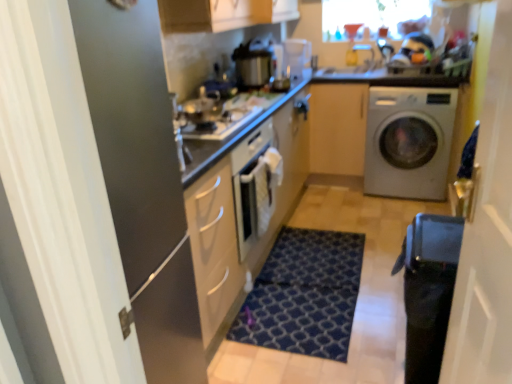
Locate an element on the screen. The height and width of the screenshot is (384, 512). vacant space in dark blue textured rug at center (from a real-world perspective) is located at coordinates (313, 292).